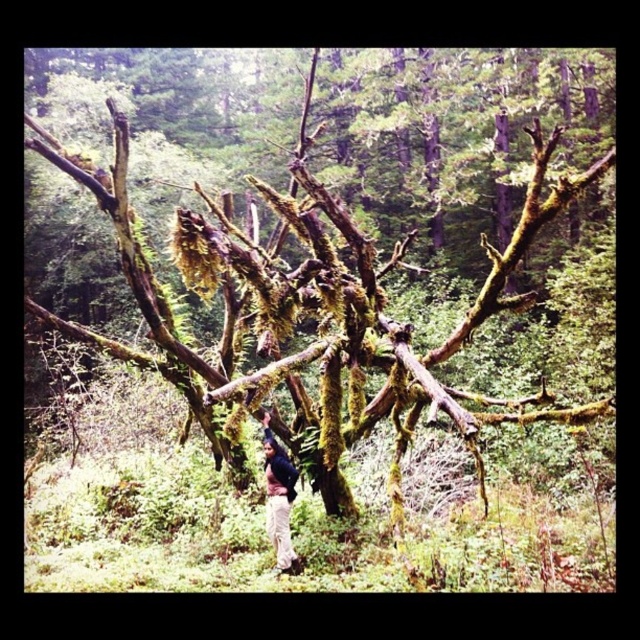
Question: Which object is farther from the camera taking this photo?

Choices:
 (A) green mossy tree at center
 (B) light beige pants at lower center

Answer: (A)

Question: Which point is closer to the camera?

Choices:
 (A) green mossy tree at center
 (B) light beige pants at lower center

Answer: (B)

Question: Does green mossy tree at center have a smaller size compared to light beige pants at lower center?

Choices:
 (A) no
 (B) yes

Answer: (B)

Question: Can you confirm if green mossy tree at center is thinner than light beige pants at lower center?

Choices:
 (A) yes
 (B) no

Answer: (A)

Question: Can you confirm if green mossy tree at center is positioned above light beige pants at lower center?

Choices:
 (A) no
 (B) yes

Answer: (A)